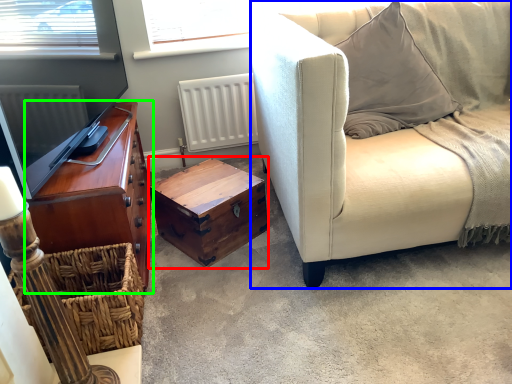
Question: Based on their relative distances, which object is farther from chest (highlighted by a red box)? Choose from studio couch (highlighted by a blue box) and cabinetry (highlighted by a green box).

Choices:
 (A) studio couch
 (B) cabinetry

Answer: (A)